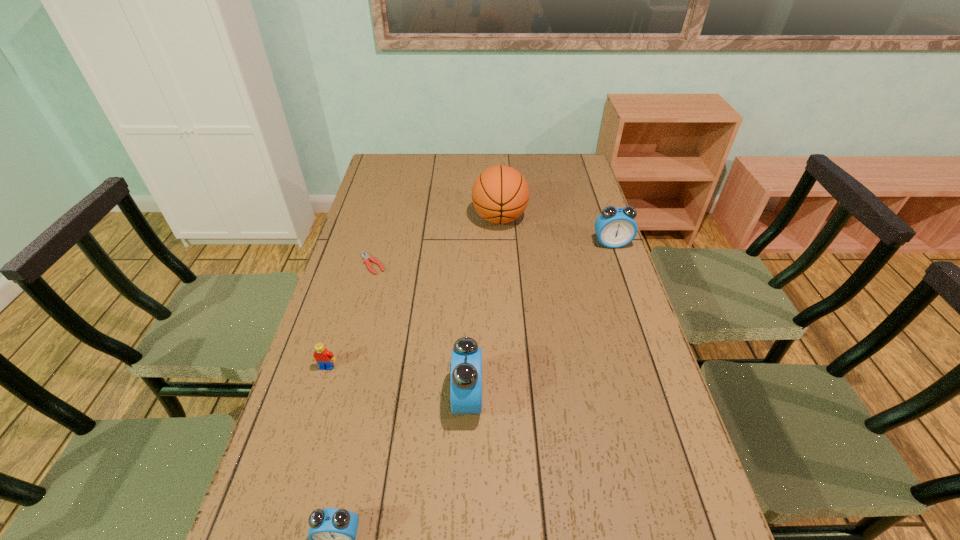
Find the location of a particular element. free location that satisfies the following two spatial constraints: 1. on the face of the farthest alarm clock; 2. on the face of the second nearest alarm clock is located at coordinates (665, 399).

Locate an element on the screen. The image size is (960, 540). free space that satisfies the following two spatial constraints: 1. on the back side of the basketball; 2. on the right side of the pliers is located at coordinates (385, 218).